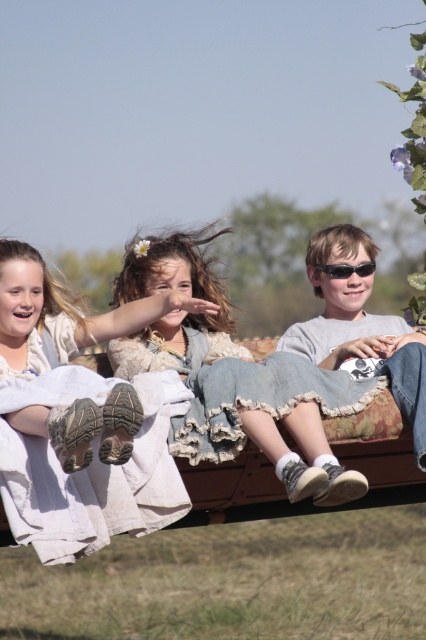
Question: Which of these objects is positioned closest to the denim jeans at right?

Choices:
 (A) denim jeans at center
 (B) black plastic sunglasses at center right
 (C) denim skirt at center

Answer: (B)

Question: Is denim skirt at center closer to camera compared to denim jeans at right?

Choices:
 (A) yes
 (B) no

Answer: (A)

Question: Which of the following is the farthest from the observer?

Choices:
 (A) (69, 419)
 (B) (158, 333)

Answer: (B)

Question: Among these points, which one is nearest to the camera?

Choices:
 (A) (147, 348)
 (B) (397, 372)
 (C) (65, 339)
 (D) (342, 262)

Answer: (B)

Question: Does denim skirt at center appear on the left side of denim jeans at right?

Choices:
 (A) yes
 (B) no

Answer: (A)

Question: Is denim jeans at center thinner than denim jeans at right?

Choices:
 (A) no
 (B) yes

Answer: (A)